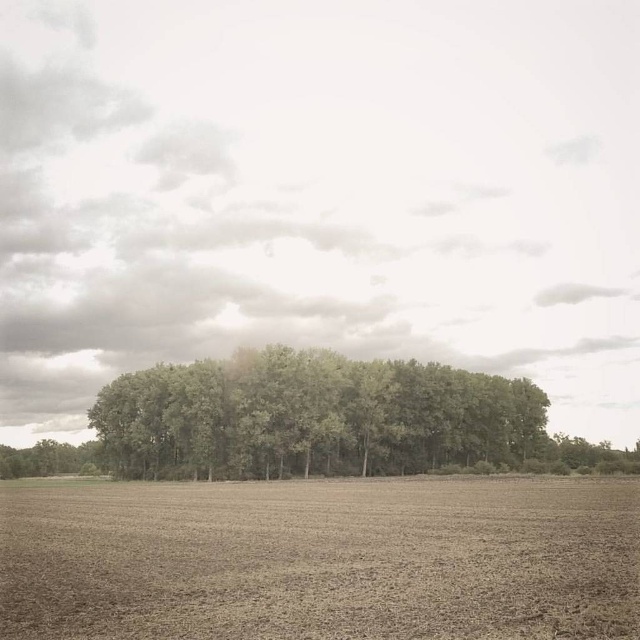
You are a farmer planning to plant crops in the brown soil at center. Considering the presence of the green leafy trees at center, which object occupies more space horizontally in the image?

The green leafy trees at center occupy more horizontal space than the brown soil at center because the brown soil is thinner than the trees.

You are a farmer planning to plant crops in the brown soil at center. Considering the presence of the green leafy trees at center, what potential issue might you face with sunlight reaching your crops?

The green leafy trees at center are larger than the brown soil at center, which means they could cast significant shade over the area, reducing sunlight available for crops.

You are a farmer standing in the middle of the field. You notice the brown soil at center and the green leafy trees at center. Which object is closer to the ground?

The brown soil at center is closer to the ground because it is shorter than the green leafy trees at center.